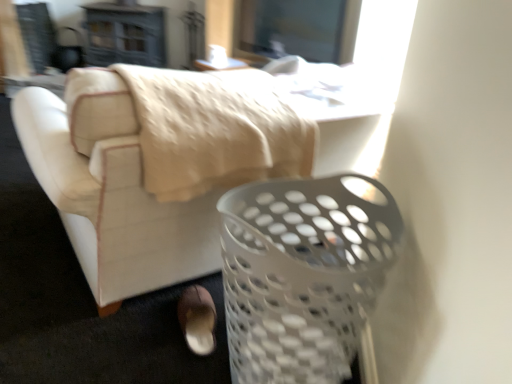
Question: From the image's perspective, is white plastic laundry basket at lower right on white plastic table at upper center?

Choices:
 (A) no
 (B) yes

Answer: (A)

Question: Is white plastic laundry basket at lower right located outside white plastic table at upper center?

Choices:
 (A) yes
 (B) no

Answer: (A)

Question: Considering the relative positions of white plastic laundry basket at lower right and white plastic table at upper center in the image provided, is white plastic laundry basket at lower right to the left of white plastic table at upper center from the viewer's perspective?

Choices:
 (A) no
 (B) yes

Answer: (A)

Question: Does white plastic laundry basket at lower right have a lesser height compared to white plastic table at upper center?

Choices:
 (A) no
 (B) yes

Answer: (A)

Question: Can you confirm if white plastic laundry basket at lower right is wider than white plastic table at upper center?

Choices:
 (A) yes
 (B) no

Answer: (A)

Question: Can white plastic table at upper center be found inside white plastic laundry basket at lower right?

Choices:
 (A) yes
 (B) no

Answer: (B)

Question: Considering the relative sizes of white plastic basket at lower right and brown suede shoe at lower center in the image provided, is white plastic basket at lower right taller than brown suede shoe at lower center?

Choices:
 (A) yes
 (B) no

Answer: (A)

Question: Is the depth of white plastic basket at lower right less than that of brown suede shoe at lower center?

Choices:
 (A) no
 (B) yes

Answer: (B)

Question: Is white plastic basket at lower right to the left of brown suede shoe at lower center from the viewer's perspective?

Choices:
 (A) no
 (B) yes

Answer: (A)

Question: Does white plastic basket at lower right have a lesser height compared to brown suede shoe at lower center?

Choices:
 (A) no
 (B) yes

Answer: (A)

Question: Is brown suede shoe at lower center surrounded by white plastic basket at lower right?

Choices:
 (A) yes
 (B) no

Answer: (B)

Question: Is white plastic basket at lower right at the right side of brown suede shoe at lower center?

Choices:
 (A) yes
 (B) no

Answer: (A)

Question: Is white plastic table at upper center placed right next to white plastic laundry basket at lower right?

Choices:
 (A) yes
 (B) no

Answer: (B)